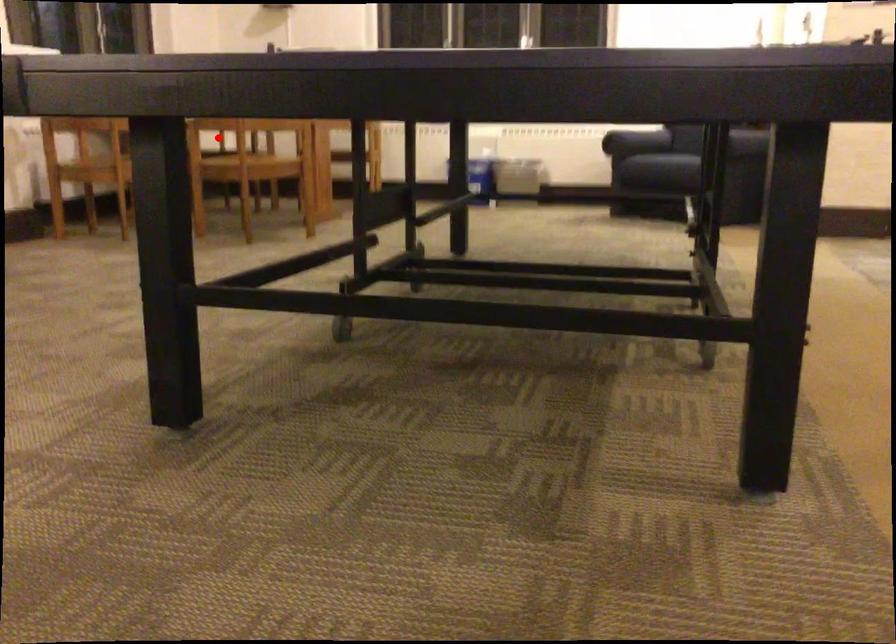
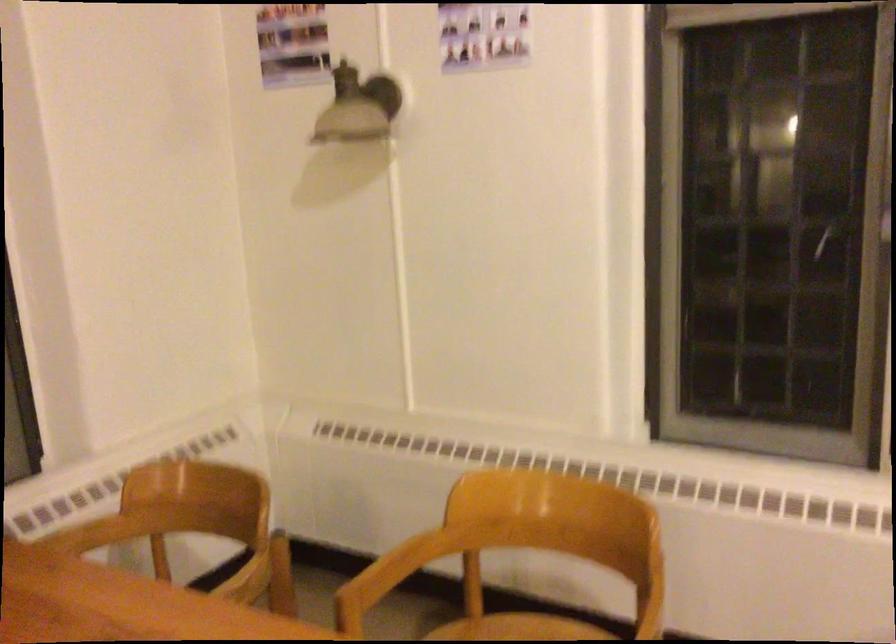
Where in the second image is the point corresponding to the highlighted location from the first image?

(92, 534)